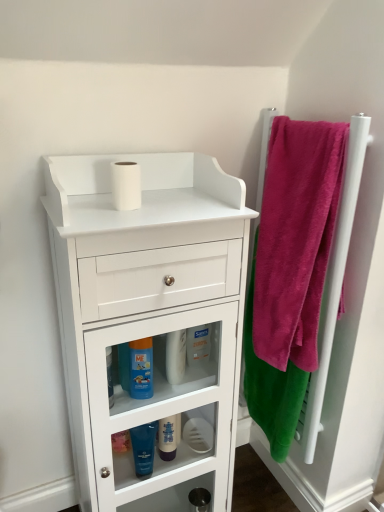
Question: Is blue glossy mouthwash at lower center, the first mouthwash in the top-to-bottom sequence, in front of or behind velvet pink towel at right in the image?

Choices:
 (A) behind
 (B) front

Answer: (A)

Question: Visually, is blue glossy mouthwash at lower center, which is the 3th mouthwash in bottom-to-top order, positioned to the left or to the right of velvet pink towel at right?

Choices:
 (A) right
 (B) left

Answer: (B)

Question: Estimate the real-world distances between objects in this image. Which object is closer to the white matte cabinet at center?

Choices:
 (A) white matte toilet paper at center, the second toilet paper positioned from the left
 (B) white matte toilet paper at upper center, the second toilet paper in the bottom-to-top sequence
 (C) pink soft towel at right
 (D) velvet pink towel at right
 (E) translucent plastic mouthwash at lower center, the second mouthwash positioned from the top

Answer: (D)

Question: Estimate the real-world distances between objects in this image. Which object is farther from the white plastic bottle at center?

Choices:
 (A) blue glossy mouthwash at lower center, which is the 3th mouthwash in bottom-to-top order
 (B) translucent plastic mouthwash at lower center, the second mouthwash ordered from the bottom
 (C) white matte toilet paper at center, which appears as the first toilet paper when ordered from the bottom
 (D) blue glossy mouthwash at lower center, positioned as the first mouthwash in bottom-to-top order
 (E) pink soft towel at right

Answer: (E)